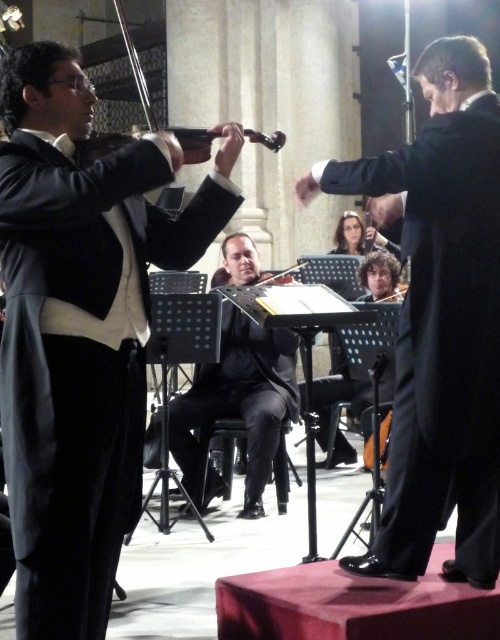
Question: Among these points, which one is farthest from the camera?

Choices:
 (A) (330, 380)
 (B) (220, 285)

Answer: (B)

Question: Does black glossy suit at center appear over black smooth suit at center?

Choices:
 (A) no
 (B) yes

Answer: (B)

Question: Does black glossy suit at center have a lesser width compared to black smooth suit at center?

Choices:
 (A) yes
 (B) no

Answer: (A)

Question: Can you confirm if black smooth suit at center is smaller than curly-haired man at center?

Choices:
 (A) no
 (B) yes

Answer: (A)

Question: Which of the following is the closest to the observer?

Choices:
 (A) wooden violin at center
 (B) shiny black violin at left
 (C) matte black violin at left

Answer: (C)

Question: Which point is closer to the camera?

Choices:
 (A) black glossy suit at center
 (B) matte black violin at left

Answer: (B)